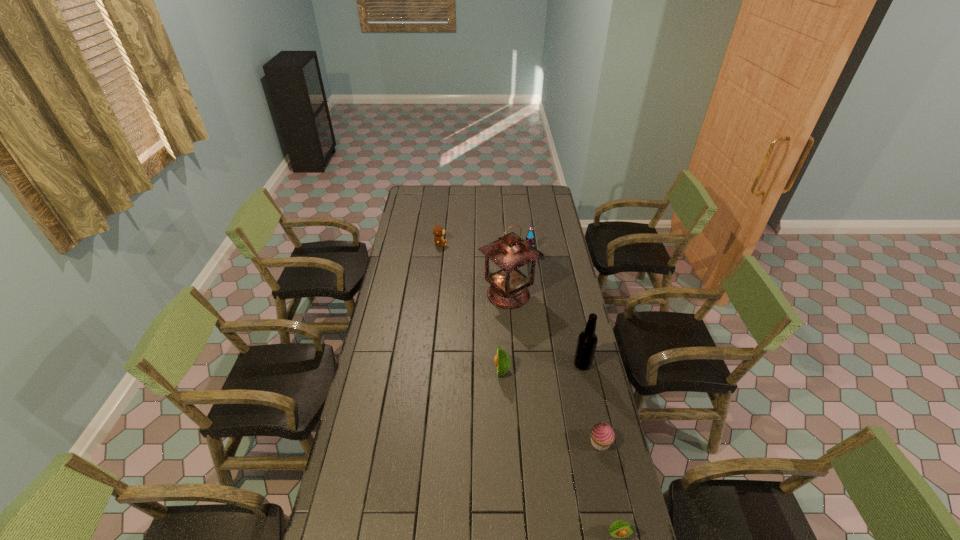
Identify the location of vacant region at the left edge of the desktop. This screenshot has height=540, width=960. (420, 258).

You are a GUI agent. You are given a task and a screenshot of the screen. Output one action in this format:
    pyautogui.click(x=<x>, y=<y>)
    Task: Click on the vacant area at the right edge of the desktop
    The height and width of the screenshot is (540, 960).
    Given the screenshot: What is the action you would take?
    pyautogui.click(x=618, y=502)

This screenshot has height=540, width=960. I want to click on vacant space at the far left corner, so click(x=430, y=192).

The width and height of the screenshot is (960, 540). In order to click on free space between the left avocado and the second nearest object in this screenshot , I will do `click(551, 407)`.

Where is `vacant region between the soda and the beer bottle`? This screenshot has width=960, height=540. vacant region between the soda and the beer bottle is located at coordinates (556, 307).

In order to click on free spot between the teddy bear and the sixth farthest object in this screenshot , I will do `click(520, 343)`.

Find the location of `unoccupied position between the tallest object and the sixth farthest object`. unoccupied position between the tallest object and the sixth farthest object is located at coordinates (554, 368).

This screenshot has height=540, width=960. Identify the location of free spot between the teddy bear and the second nearest object. (520, 343).

Point out which object is positioned as the fourth nearest to the leftmost object. Please provide its 2D coordinates. Your answer should be formatted as a tuple, i.e. [(x, y)], where the tuple contains the x and y coordinates of a point satisfying the conditions above.

[(587, 341)]

The width and height of the screenshot is (960, 540). I want to click on object that is the fourth nearest to the second tallest object, so click(x=619, y=529).